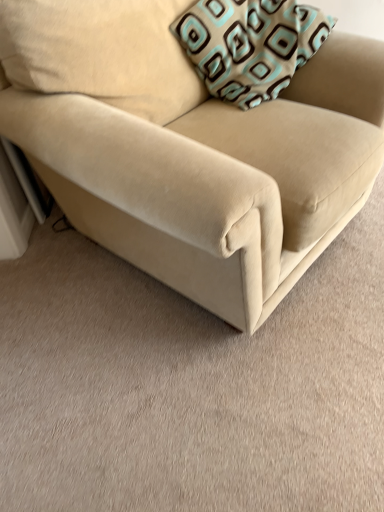
Question: Considering the relative sizes of beige fabric couch at center and teal-patterned fabric pillow at upper right in the image provided, is beige fabric couch at center shorter than teal-patterned fabric pillow at upper right?

Choices:
 (A) no
 (B) yes

Answer: (A)

Question: Does beige fabric couch at center have a greater height compared to teal-patterned fabric pillow at upper right?

Choices:
 (A) no
 (B) yes

Answer: (B)

Question: From a real-world perspective, is beige fabric couch at center physically above teal-patterned fabric pillow at upper right?

Choices:
 (A) no
 (B) yes

Answer: (A)

Question: Is beige fabric couch at center further to camera compared to teal-patterned fabric pillow at upper right?

Choices:
 (A) yes
 (B) no

Answer: (B)

Question: Is beige fabric couch at center positioned with its back to teal-patterned fabric pillow at upper right?

Choices:
 (A) yes
 (B) no

Answer: (A)

Question: Is teal-patterned fabric pillow at upper right located within beige fabric couch at center?

Choices:
 (A) yes
 (B) no

Answer: (A)

Question: Does teal-patterned fabric pillow at upper right have a smaller size compared to beige fabric couch at center?

Choices:
 (A) yes
 (B) no

Answer: (A)

Question: Is teal-patterned fabric pillow at upper right bigger than beige fabric couch at center?

Choices:
 (A) no
 (B) yes

Answer: (A)

Question: Does teal-patterned fabric pillow at upper right have a lesser width compared to beige fabric couch at center?

Choices:
 (A) yes
 (B) no

Answer: (A)

Question: Could you tell me if teal-patterned fabric pillow at upper right is facing beige fabric couch at center?

Choices:
 (A) no
 (B) yes

Answer: (B)

Question: Is there a large distance between teal-patterned fabric pillow at upper right and beige fabric couch at center?

Choices:
 (A) yes
 (B) no

Answer: (B)

Question: Considering the relative positions of teal-patterned fabric pillow at upper right and beige fabric couch at center in the image provided, is teal-patterned fabric pillow at upper right behind beige fabric couch at center?

Choices:
 (A) yes
 (B) no

Answer: (A)

Question: In the image, is beige fabric couch at center positioned in front of or behind teal-patterned fabric pillow at upper right?

Choices:
 (A) front
 (B) behind

Answer: (A)